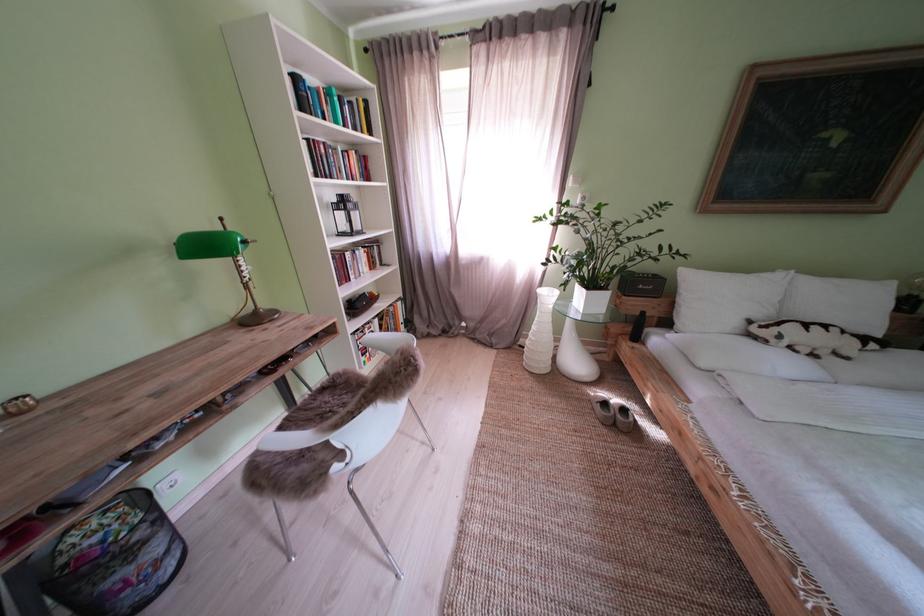
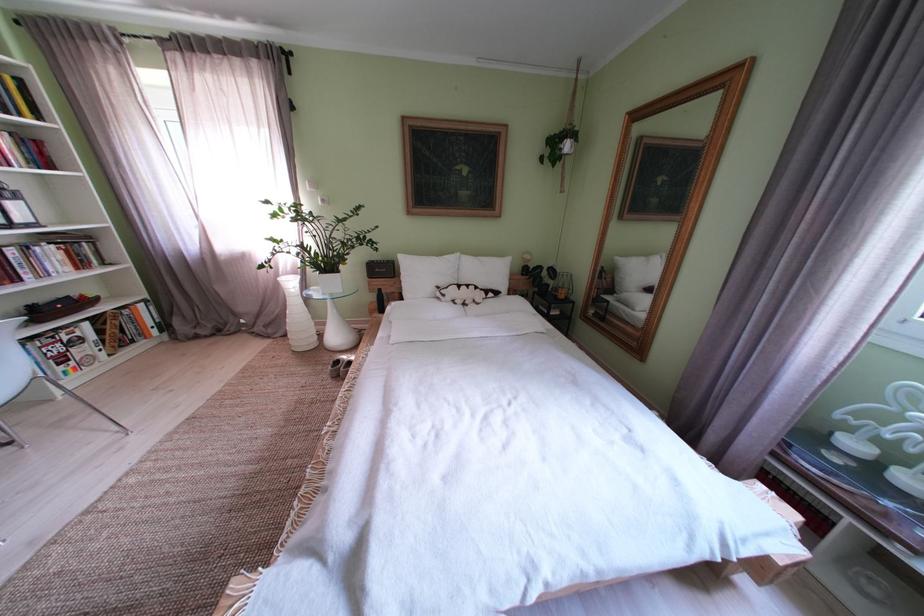
Where in the second image is the point corresponding to [383,299] from the first image?

(92, 302)